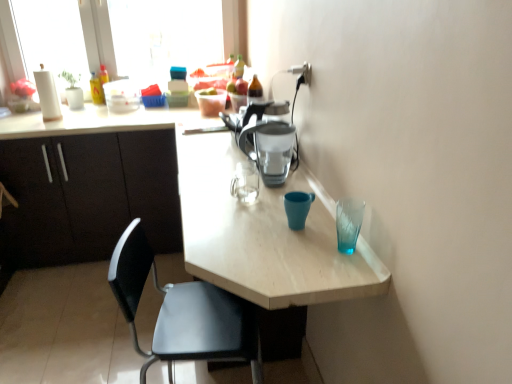
Question: Can you confirm if matte black cabinets at left is positioned to the left of matte plastic coffee pot at center?

Choices:
 (A) no
 (B) yes

Answer: (B)

Question: Can you confirm if matte black cabinets at left is shorter than matte plastic coffee pot at center?

Choices:
 (A) no
 (B) yes

Answer: (A)

Question: Does matte black cabinets at left touch matte plastic coffee pot at center?

Choices:
 (A) yes
 (B) no

Answer: (B)

Question: Is matte black cabinets at left not inside matte plastic coffee pot at center?

Choices:
 (A) no
 (B) yes

Answer: (B)

Question: From the image's perspective, is matte black cabinets at left beneath matte plastic coffee pot at center?

Choices:
 (A) yes
 (B) no

Answer: (A)

Question: Considering the relative sizes of matte black cabinets at left and matte plastic coffee pot at center in the image provided, is matte black cabinets at left taller than matte plastic coffee pot at center?

Choices:
 (A) no
 (B) yes

Answer: (B)

Question: Does light wood table at center have a lesser width compared to matte plastic coffee pot at center?

Choices:
 (A) yes
 (B) no

Answer: (B)

Question: Is light wood table at center oriented towards matte plastic coffee pot at center?

Choices:
 (A) no
 (B) yes

Answer: (A)

Question: Is there a large distance between light wood table at center and matte plastic coffee pot at center?

Choices:
 (A) no
 (B) yes

Answer: (A)

Question: Is light wood table at center bigger than matte plastic coffee pot at center?

Choices:
 (A) no
 (B) yes

Answer: (B)

Question: Is light wood table at center shorter than matte plastic coffee pot at center?

Choices:
 (A) yes
 (B) no

Answer: (B)

Question: Considering the relative sizes of light wood table at center and matte plastic coffee pot at center in the image provided, is light wood table at center smaller than matte plastic coffee pot at center?

Choices:
 (A) yes
 (B) no

Answer: (B)

Question: Does black plastic chair at lower left have a greater height compared to matte black cabinets at left?

Choices:
 (A) no
 (B) yes

Answer: (A)